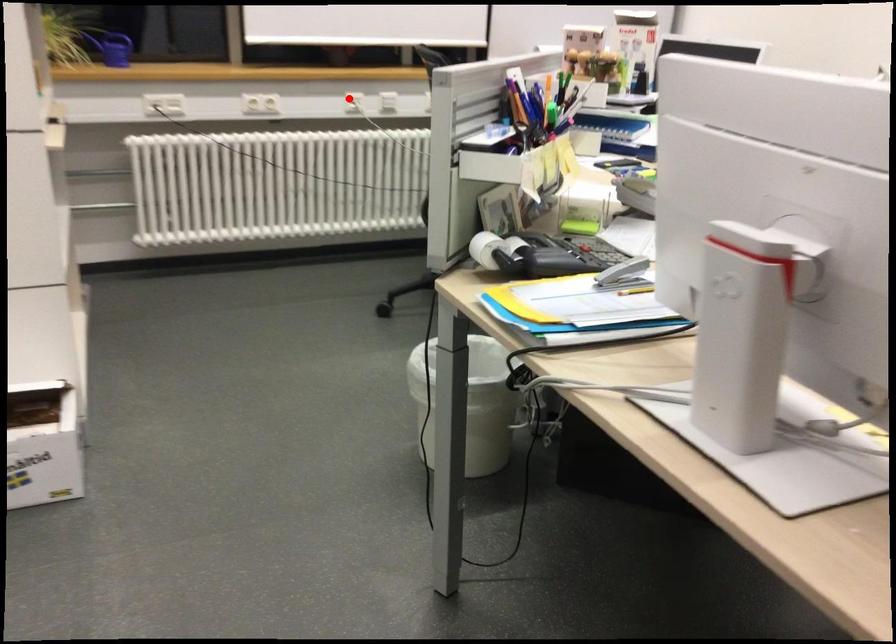
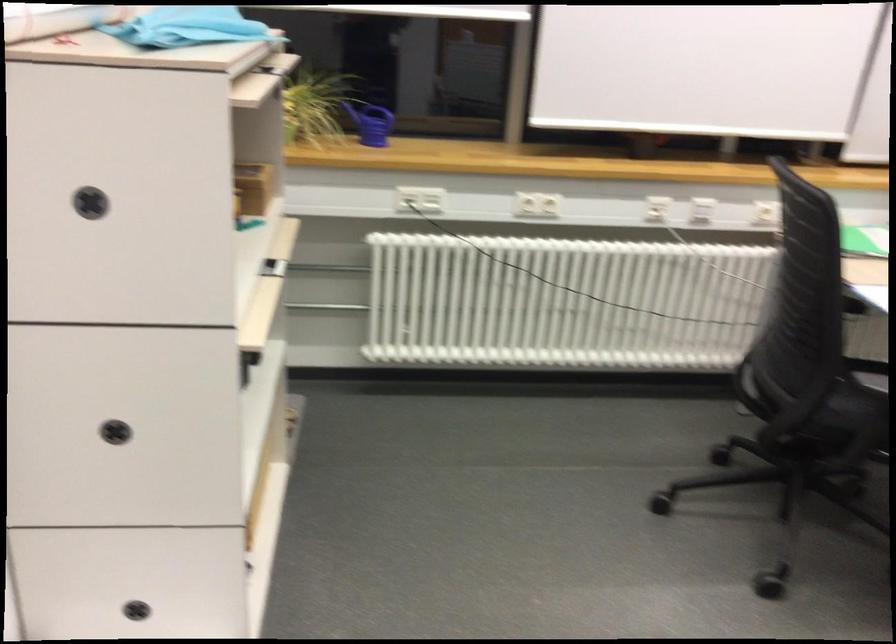
Question: I am providing you with two images of the same scene from different viewpoints. Given a red point in image1, look at the same physical point in image2. Is it:

Choices:
 (A) Closer to the viewpoint
 (B) Farther from the viewpoint

Answer: (A)